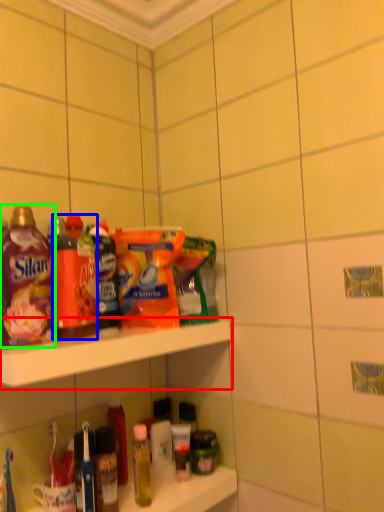
Question: Which object is the closest to the shelf (highlighted by a red box)? Choose among these: bottle (highlighted by a blue box) or bottle (highlighted by a green box).

Choices:
 (A) bottle
 (B) bottle

Answer: (A)